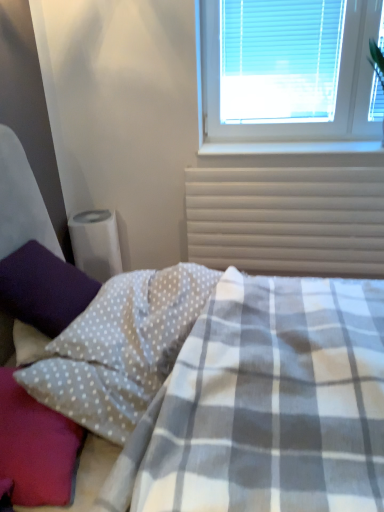
Question: Is purple fuzzy pillow at left, the third pillow when ordered from right to left, next to white plastic blinds at upper right and touching it?

Choices:
 (A) no
 (B) yes

Answer: (A)

Question: Considering the relative positions of purple fuzzy pillow at left, which is the first pillow from left to right, and white plastic blinds at upper right in the image provided, is purple fuzzy pillow at left, which is the first pillow from left to right, to the right of white plastic blinds at upper right from the viewer's perspective?

Choices:
 (A) no
 (B) yes

Answer: (A)

Question: Is purple fuzzy pillow at left, the third pillow when ordered from right to left, completely or partially outside of white plastic blinds at upper right?

Choices:
 (A) yes
 (B) no

Answer: (A)

Question: Can you confirm if purple fuzzy pillow at left, which is the first pillow from left to right, is bigger than white plastic blinds at upper right?

Choices:
 (A) yes
 (B) no

Answer: (A)

Question: In the image, is white plastic blinds at upper right positioned in front of or behind white dotted fabric pillow at lower left, which ranks as the third pillow in left-to-right order?

Choices:
 (A) behind
 (B) front

Answer: (A)

Question: In the image, is white plastic blinds at upper right on the left side or the right side of white dotted fabric pillow at lower left, the first pillow positioned from the right?

Choices:
 (A) left
 (B) right

Answer: (B)

Question: Based on their sizes in the image, would you say white plastic blinds at upper right is bigger or smaller than white dotted fabric pillow at lower left, the first pillow positioned from the right?

Choices:
 (A) big
 (B) small

Answer: (B)

Question: In terms of width, does white plastic blinds at upper right look wider or thinner when compared to white dotted fabric pillow at lower left, which ranks as the third pillow in left-to-right order?

Choices:
 (A) thin
 (B) wide

Answer: (A)

Question: Is white dotted fabric pillow at lower left, the second pillow positioned from the left, wider or thinner than white dotted fabric pillow at lower left, the first pillow positioned from the right?

Choices:
 (A) wide
 (B) thin

Answer: (B)

Question: Considering the positions of white dotted fabric pillow at lower left, acting as the second pillow starting from the right, and white dotted fabric pillow at lower left, the first pillow positioned from the right, in the image, is white dotted fabric pillow at lower left, acting as the second pillow starting from the right, taller or shorter than white dotted fabric pillow at lower left, the first pillow positioned from the right,?

Choices:
 (A) tall
 (B) short

Answer: (B)

Question: From the image's perspective, is white dotted fabric pillow at lower left, the second pillow positioned from the left, positioned above or below white dotted fabric pillow at lower left, the first pillow positioned from the right?

Choices:
 (A) below
 (B) above

Answer: (A)

Question: From a real-world perspective, is white dotted fabric pillow at lower left, acting as the second pillow starting from the right, positioned above or below white dotted fabric pillow at lower left, the first pillow positioned from the right?

Choices:
 (A) above
 (B) below

Answer: (B)

Question: Based on their sizes in the image, would you say white dotted fabric pillow at lower left, the second pillow positioned from the left, is bigger or smaller than white plastic radiator at upper right?

Choices:
 (A) small
 (B) big

Answer: (A)

Question: From a real-world perspective, relative to white plastic radiator at upper right, is white dotted fabric pillow at lower left, the second pillow positioned from the left, vertically above or below?

Choices:
 (A) below
 (B) above

Answer: (B)